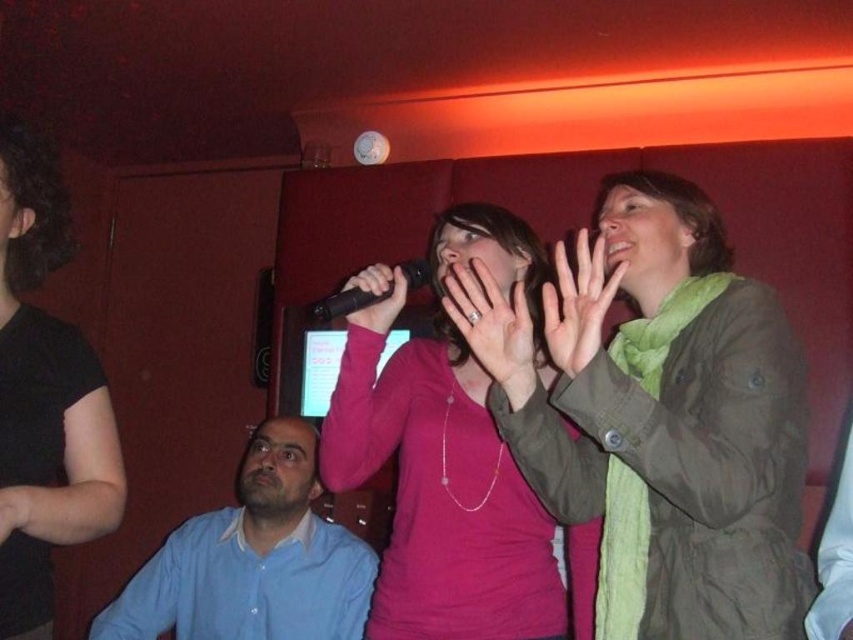
Can you confirm if black shirt at left is wider than green fabric hand at upper center?

Yes, black shirt at left is wider than green fabric hand at upper center.

Does black shirt at left appear on the right side of green fabric hand at upper center?

No, black shirt at left is not to the right of green fabric hand at upper center.

Identify the location of black shirt at left. The image size is (853, 640). (44, 396).

I want to click on black shirt at left, so click(x=44, y=396).

Does matte black microphone at center have a lesser height compared to black plastic microphone at center?

Incorrect, matte black microphone at center's height does not fall short of black plastic microphone at center's.

Describe the element at coordinates (378, 294) in the screenshot. I see `matte black microphone at center` at that location.

Find the location of a particular element. The width and height of the screenshot is (853, 640). matte black microphone at center is located at coordinates (378, 294).

This screenshot has width=853, height=640. What do you see at coordinates (578, 301) in the screenshot?
I see `green fabric hand at upper center` at bounding box center [578, 301].

Is point (566, 358) closer to camera compared to point (386, 296)?

Yes, point (566, 358) is in front of point (386, 296).

Who is more distant from viewer, [543,289] or [364,321]?

Point [364,321]

Locate an element on the screen. Image resolution: width=853 pixels, height=640 pixels. green fabric hand at upper center is located at coordinates (578, 301).